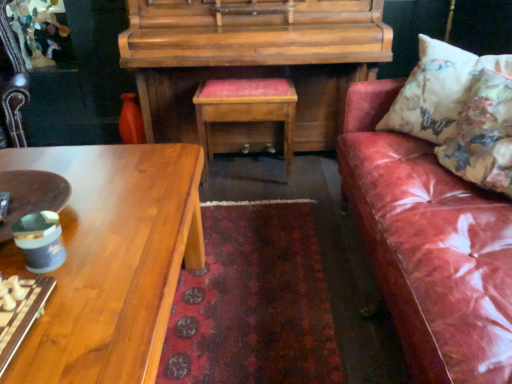
Question: Is floral fabric cushion at right, marked as the 2th pillow in a front-to-back arrangement, at the back of floral fabric cushion at right, placed as the second pillow when sorted from back to front?

Choices:
 (A) yes
 (B) no

Answer: (B)

Question: Is floral fabric cushion at right, placed as the second pillow when sorted from back to front, shorter than floral fabric cushion at right, marked as the 2th pillow in a front-to-back arrangement?

Choices:
 (A) no
 (B) yes

Answer: (B)

Question: Considering the relative sizes of floral fabric cushion at right, placed as the second pillow when sorted from back to front, and floral fabric cushion at right, marked as the 2th pillow in a front-to-back arrangement, in the image provided, is floral fabric cushion at right, placed as the second pillow when sorted from back to front, taller than floral fabric cushion at right, marked as the 2th pillow in a front-to-back arrangement,?

Choices:
 (A) no
 (B) yes

Answer: (A)

Question: Is floral fabric cushion at right, which ranks as the 1th pillow in front-to-back order, thinner than floral fabric cushion at right, marked as the 2th pillow in a front-to-back arrangement?

Choices:
 (A) yes
 (B) no

Answer: (B)

Question: Can you confirm if floral fabric cushion at right, placed as the second pillow when sorted from back to front, is wider than floral fabric cushion at right, marked as the 2th pillow in a front-to-back arrangement?

Choices:
 (A) yes
 (B) no

Answer: (A)

Question: Considering the positions of woodenwoodentable at center and leather couch at right in the image, is woodenwoodentable at center taller or shorter than leather couch at right?

Choices:
 (A) short
 (B) tall

Answer: (A)

Question: From the image's perspective, relative to leather couch at right, is woodenwoodentable at center above or below?

Choices:
 (A) below
 (B) above

Answer: (B)

Question: Considering the positions of woodenwoodentable at center and leather couch at right in the image, is woodenwoodentable at center bigger or smaller than leather couch at right?

Choices:
 (A) small
 (B) big

Answer: (A)

Question: Looking at their shapes, would you say woodenwoodentable at center is wider or thinner than leather couch at right?

Choices:
 (A) wide
 (B) thin

Answer: (B)

Question: From the image's perspective, relative to leather couch at right, is floral fabric cushion at right, marked as the 2th pillow in a front-to-back arrangement, above or below?

Choices:
 (A) above
 (B) below

Answer: (A)

Question: Based on their sizes in the image, would you say floral fabric cushion at right, marked as the 2th pillow in a front-to-back arrangement, is bigger or smaller than leather couch at right?

Choices:
 (A) big
 (B) small

Answer: (B)

Question: Is floral fabric cushion at right, which is the first pillow in back-to-front order, spatially inside leather couch at right, or outside of it?

Choices:
 (A) outside
 (B) inside

Answer: (B)

Question: Would you say floral fabric cushion at right, which is the first pillow in back-to-front order, is to the left or to the right of leather couch at right in the picture?

Choices:
 (A) left
 (B) right

Answer: (B)

Question: Relative to floral fabric cushion at right, placed as the second pillow when sorted from back to front, is shiny wood coffee table at lower left in front or behind?

Choices:
 (A) behind
 (B) front

Answer: (B)

Question: Is point (35, 367) closer or farther from the camera than point (502, 107)?

Choices:
 (A) closer
 (B) farther

Answer: (A)